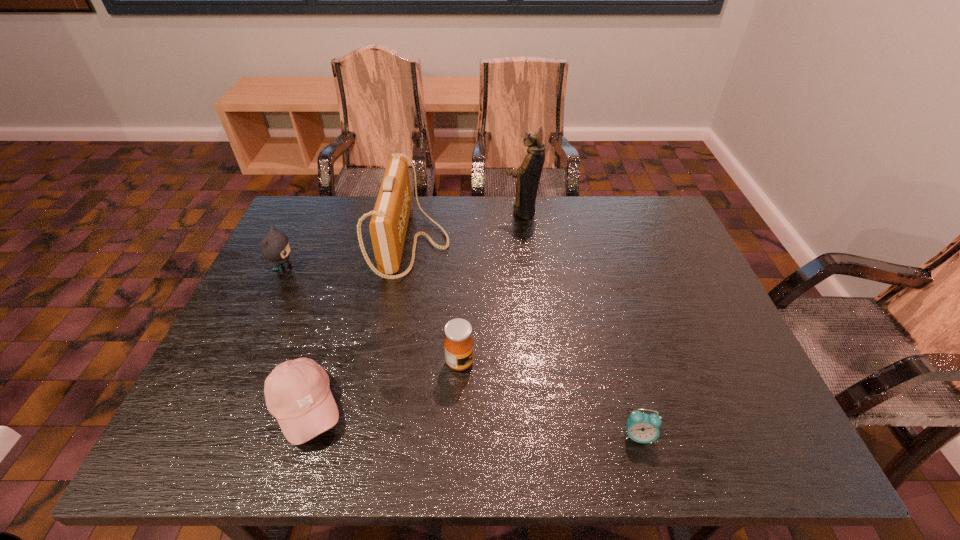
Locate an element on the screen. This screenshot has height=540, width=960. free location located 0.190m on the front-facing side of the fifth object from left to right is located at coordinates (445, 211).

Find the location of a particular element. This screenshot has height=540, width=960. free space located on the decorative side of the fifth shortest object is located at coordinates (566, 243).

Find the location of `vacant space located 0.050m on the front-facing side of the leftmost object`. vacant space located 0.050m on the front-facing side of the leftmost object is located at coordinates (315, 269).

Find the location of a particular element. The image size is (960, 540). vacant space located on the front-facing side of the fourth object from left to right is located at coordinates (579, 362).

Where is `vacant space located 0.220m on the front-facing side of the baseball cap`? This screenshot has height=540, width=960. vacant space located 0.220m on the front-facing side of the baseball cap is located at coordinates (450, 408).

Image resolution: width=960 pixels, height=540 pixels. What are the coordinates of `figurine present at the far edge` in the screenshot? It's located at (528, 175).

The height and width of the screenshot is (540, 960). I want to click on handbag at the far edge, so click(388, 225).

Identify the location of baseball cap that is positioned at the near edge. This screenshot has height=540, width=960. (297, 392).

Find the location of a particular element. The image size is (960, 540). alarm clock at the near edge is located at coordinates (x=643, y=428).

The width and height of the screenshot is (960, 540). Find the location of `kitten that is at the left edge`. kitten that is at the left edge is located at coordinates (275, 246).